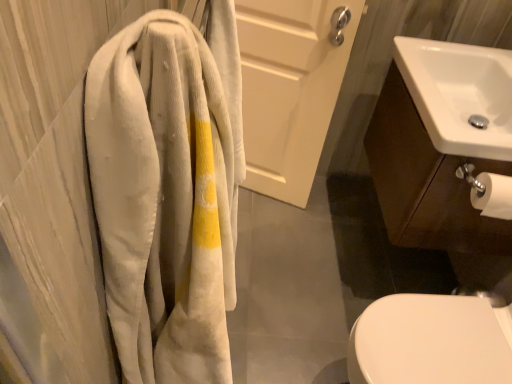
Question: In terms of height, does white glossy sink at upper right look taller or shorter compared to white matte door at upper center?

Choices:
 (A) short
 (B) tall

Answer: (A)

Question: Looking at their shapes, would you say white glossy sink at upper right is wider or thinner than white matte door at upper center?

Choices:
 (A) wide
 (B) thin

Answer: (A)

Question: Estimate the real-world distances between objects in this image. Which object is closer to the white glossy sink at upper right?

Choices:
 (A) white matte door at upper center
 (B) corduroy towel at left
 (C) white glossy sink at right

Answer: (C)

Question: Which is nearer to the corduroy towel at left?

Choices:
 (A) white glossy sink at upper right
 (B) white glossy sink at right
 (C) white matte door at upper center

Answer: (B)